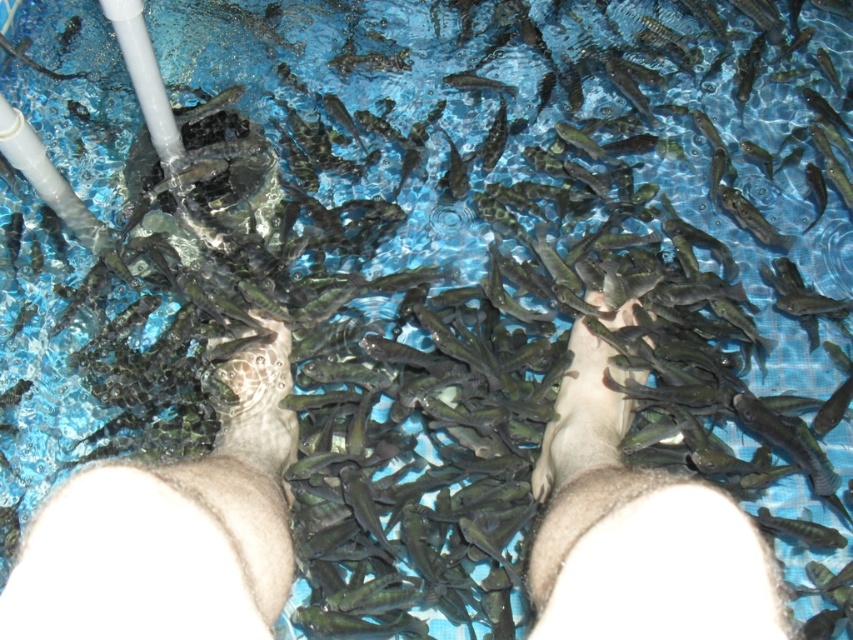
Between smooth skin feet at center and smooth skin hand at center, which one is positioned lower?

smooth skin feet at center is below.

Based on the photo, is smooth skin feet at center positioned behind smooth skin hand at center?

That is False.

Describe the element at coordinates (170, 531) in the screenshot. The image size is (853, 640). I see `smooth skin feet at center` at that location.

You are a GUI agent. You are given a task and a screenshot of the screen. Output one action in this format:
    pyautogui.click(x=<x>, y=<y>)
    Task: Click on the smooth skin feet at center
    This screenshot has height=640, width=853.
    Given the screenshot: What is the action you would take?
    pyautogui.click(x=170, y=531)

Who is lower down, smooth skin feet at center or brown leather foot at center?

Positioned lower is smooth skin feet at center.

Can you confirm if smooth skin feet at center is smaller than brown leather foot at center?

No.

Locate an element on the screen. smooth skin feet at center is located at coordinates (170, 531).

Is the position of smooth skin hand at center less distant than that of brown leather foot at center?

Yes.

Measure the distance between smooth skin hand at center and camera.

A distance of 22.63 inches exists between smooth skin hand at center and camera.

Identify the location of smooth skin hand at center. (636, 532).